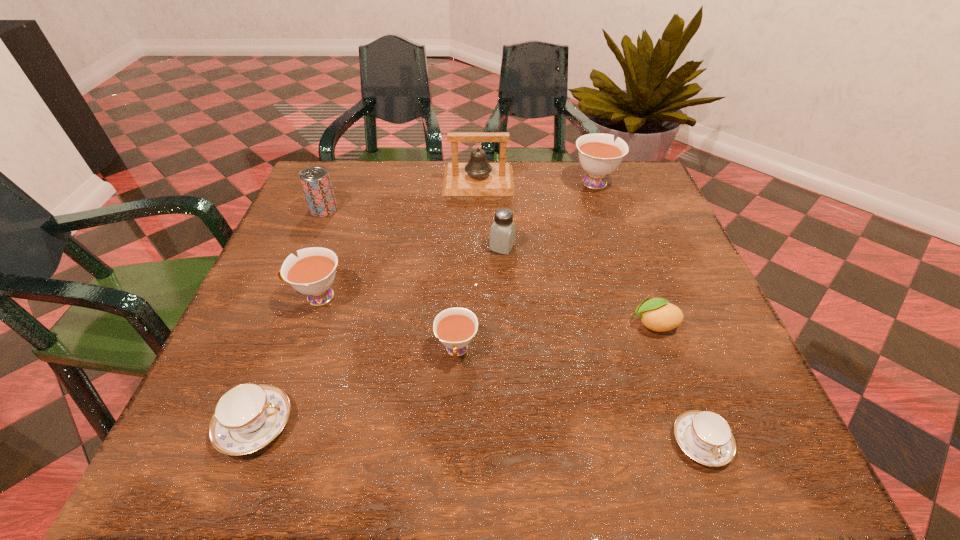
This screenshot has width=960, height=540. I want to click on blank space located with leaves positioned above the yellow lemon, so click(x=427, y=324).

Find the location of a particular element. The height and width of the screenshot is (540, 960). free space located on the side with the handle of the left blue teacup is located at coordinates (379, 424).

Identify the location of bell that is at the far edge. This screenshot has height=540, width=960. (477, 177).

Where is `teacup located in the far edge section of the desktop`? The width and height of the screenshot is (960, 540). teacup located in the far edge section of the desktop is located at coordinates (599, 155).

At what (x,y) coordinates should I click in order to perform the action: click on beer can situated at the far edge. Please return your answer as a coordinate pair (x, y). The width and height of the screenshot is (960, 540). Looking at the image, I should click on (315, 180).

At what (x,y) coordinates should I click in order to perform the action: click on beer can that is at the left edge. Please return your answer as a coordinate pair (x, y). The image size is (960, 540). Looking at the image, I should click on (315, 180).

At what (x,y) coordinates should I click in order to perform the action: click on lemon that is at the right edge. Please return your answer as a coordinate pair (x, y). Looking at the image, I should click on (657, 314).

The image size is (960, 540). Find the location of `object located at the far left corner`. object located at the far left corner is located at coordinates (315, 180).

The image size is (960, 540). Find the location of `object that is at the near left corner`. object that is at the near left corner is located at coordinates (247, 417).

This screenshot has width=960, height=540. I want to click on object that is at the far right corner, so click(x=599, y=155).